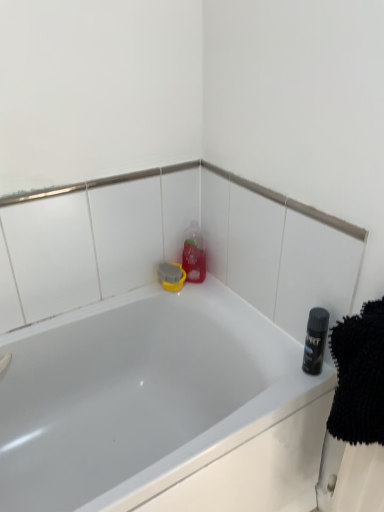
Locate an element on the screen. The image size is (384, 512). free location in front of shiny black can at right is located at coordinates coord(299,392).